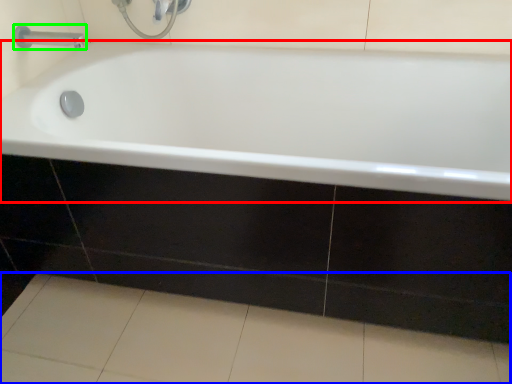
Question: Based on their relative distances, which object is farther from bathtub (highlighted by a red box)? Choose from ceramic tile (highlighted by a blue box) and tap (highlighted by a green box).

Choices:
 (A) ceramic tile
 (B) tap

Answer: (B)